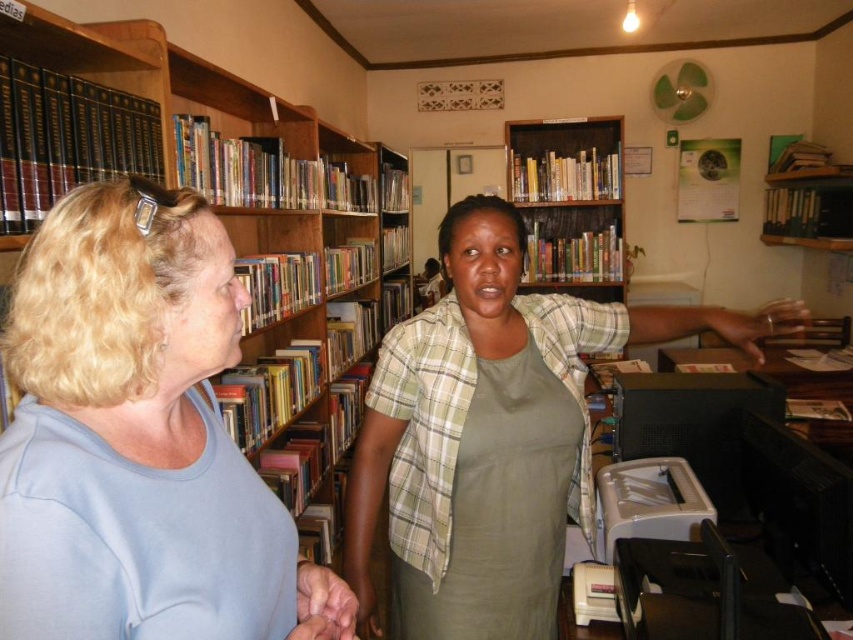
Does green cotton shirt at center have a lesser width compared to green fabric apron at center?

No, green cotton shirt at center is not thinner than green fabric apron at center.

Who is more forward, (494,220) or (416,456)?

Point (494,220)

The height and width of the screenshot is (640, 853). I want to click on green cotton shirt at center, so click(492, 435).

Who is positioned more to the left, light blue cotton shirt at left or wooden bookshelf at upper center?

From the viewer's perspective, light blue cotton shirt at left appears more on the left side.

Which of these two, light blue cotton shirt at left or wooden bookshelf at upper center, stands shorter?

light blue cotton shirt at left is shorter.

Is point (320, 605) positioned in front of point (590, 212)?

That is True.

Locate an element on the screen. The image size is (853, 640). light blue cotton shirt at left is located at coordinates (138, 440).

Does light blue cotton shirt at left appear under green fabric apron at center?

Actually, light blue cotton shirt at left is above green fabric apron at center.

Which is in front, point (21, 593) or point (415, 509)?

Positioned in front is point (21, 593).

I want to click on light blue cotton shirt at left, so click(138, 440).